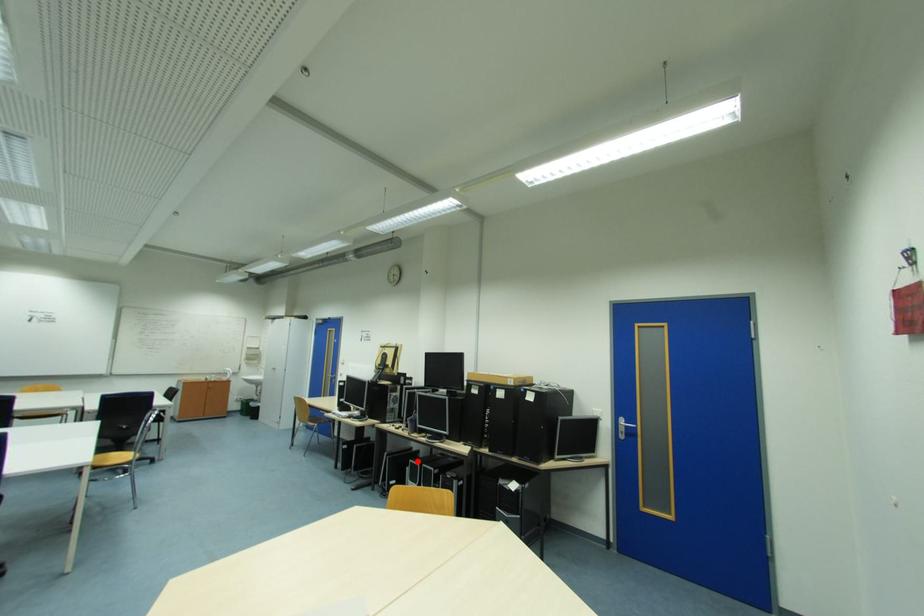
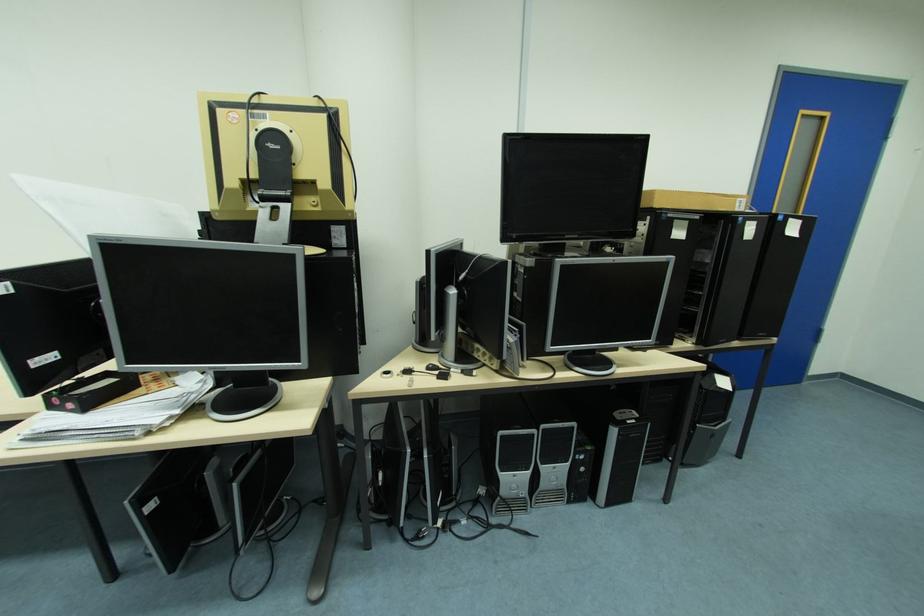
Locate, in the second image, the point that corresponds to the highlighted location in the first image.

(507, 434)